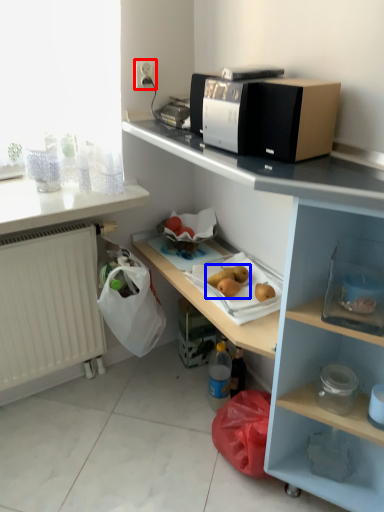
Question: Which point is further to the camera, electric outlet (highlighted by a red box) or fruit (highlighted by a blue box)?

Choices:
 (A) electric outlet
 (B) fruit

Answer: (A)